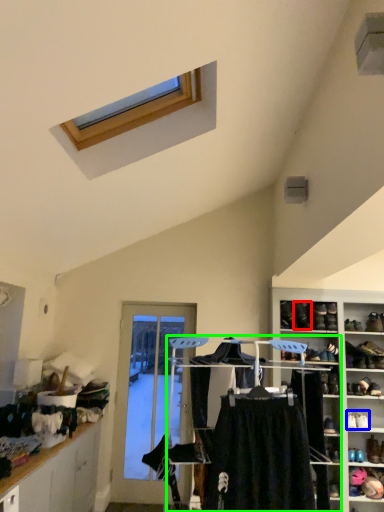
Question: Which object is positioned farthest from shoe (highlighted by a red box)? Select from footwear (highlighted by a blue box) and closet (highlighted by a green box).

Choices:
 (A) footwear
 (B) closet

Answer: (B)